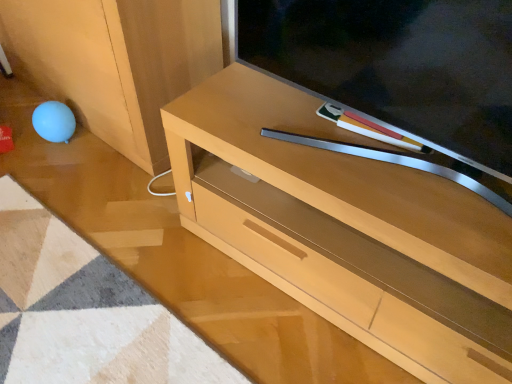
Question: Is matte wood television at center further to camera compared to light brown wood tv stand at center?

Choices:
 (A) yes
 (B) no

Answer: (B)

Question: Is matte wood television at center completely or partially outside of light brown wood tv stand at center?

Choices:
 (A) yes
 (B) no

Answer: (A)

Question: From a real-world perspective, is matte wood television at center positioned over light brown wood tv stand at center based on gravity?

Choices:
 (A) no
 (B) yes

Answer: (B)

Question: Considering the relative sizes of matte wood television at center and light brown wood tv stand at center in the image provided, is matte wood television at center wider than light brown wood tv stand at center?

Choices:
 (A) no
 (B) yes

Answer: (A)

Question: From a real-world perspective, is matte wood television at center positioned under light brown wood tv stand at center based on gravity?

Choices:
 (A) no
 (B) yes

Answer: (A)

Question: Would you say light brown wood tv stand at center is to the left or to the right of light wood cabinet at lower right in the picture?

Choices:
 (A) right
 (B) left

Answer: (A)

Question: From the image's perspective, relative to light wood cabinet at lower right, is light brown wood tv stand at center above or below?

Choices:
 (A) below
 (B) above

Answer: (A)

Question: In terms of height, does light brown wood tv stand at center look taller or shorter compared to light wood cabinet at lower right?

Choices:
 (A) short
 (B) tall

Answer: (A)

Question: Considering the positions of light brown wood tv stand at center and light wood cabinet at lower right in the image, is light brown wood tv stand at center wider or thinner than light wood cabinet at lower right?

Choices:
 (A) thin
 (B) wide

Answer: (B)

Question: Is matte wood television at center inside or outside of light brown wood tv stand at center?

Choices:
 (A) outside
 (B) inside

Answer: (A)

Question: From the image's perspective, is matte wood television at center positioned above or below light brown wood tv stand at center?

Choices:
 (A) above
 (B) below

Answer: (A)

Question: Considering the positions of matte wood television at center and light brown wood tv stand at center in the image, is matte wood television at center bigger or smaller than light brown wood tv stand at center?

Choices:
 (A) small
 (B) big

Answer: (A)

Question: Relative to light brown wood tv stand at center, is matte wood television at center in front or behind?

Choices:
 (A) front
 (B) behind

Answer: (A)

Question: From the image's perspective, is light wood cabinet at lower right above or below matte wood television at center?

Choices:
 (A) above
 (B) below

Answer: (A)

Question: Is point (114, 64) positioned closer to the camera than point (470, 36)?

Choices:
 (A) farther
 (B) closer

Answer: (A)